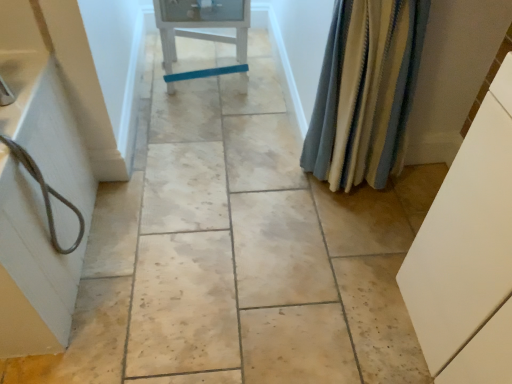
Identify the location of vacant area that lies to the right of striped fabric shower curtain at right. (409, 199).